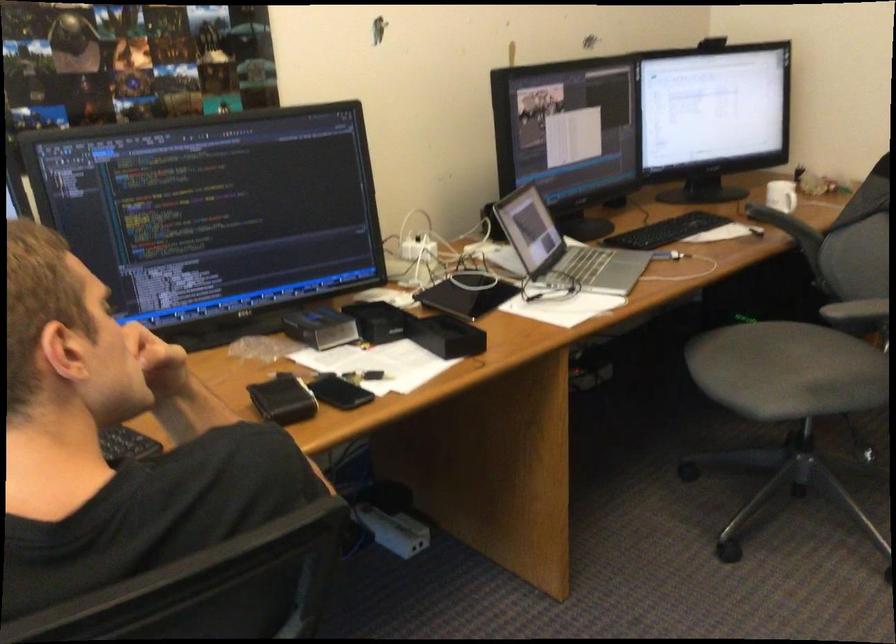
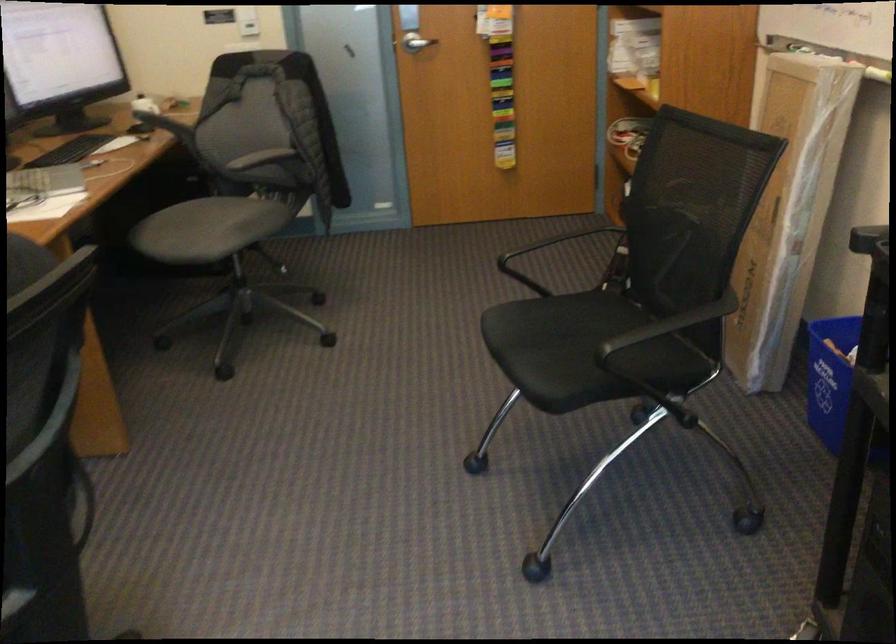
Where in the second image is the point corresponding to point 769,375 from the first image?

(207, 229)